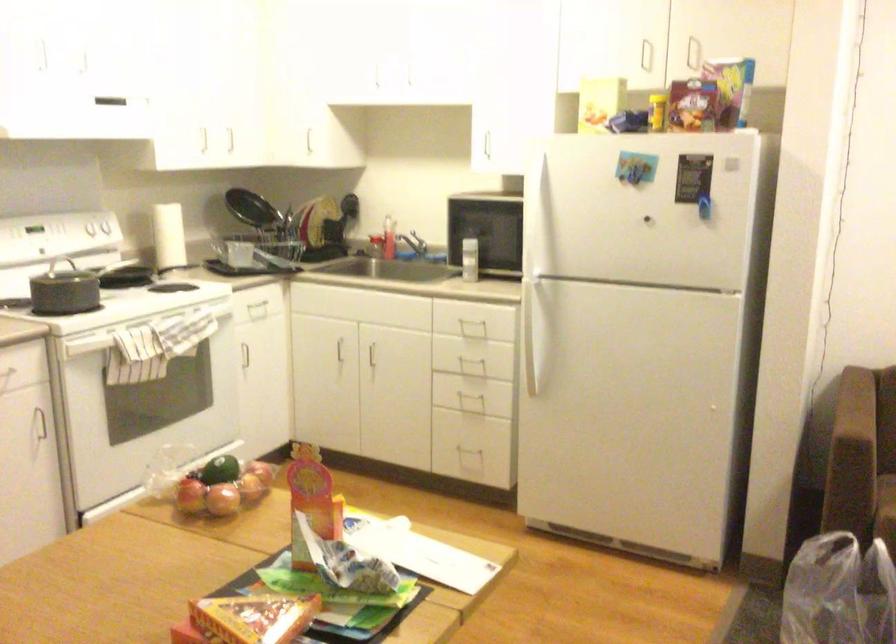
What do you see at coordinates (62, 279) in the screenshot? Image resolution: width=896 pixels, height=644 pixels. I see `the pot handle` at bounding box center [62, 279].